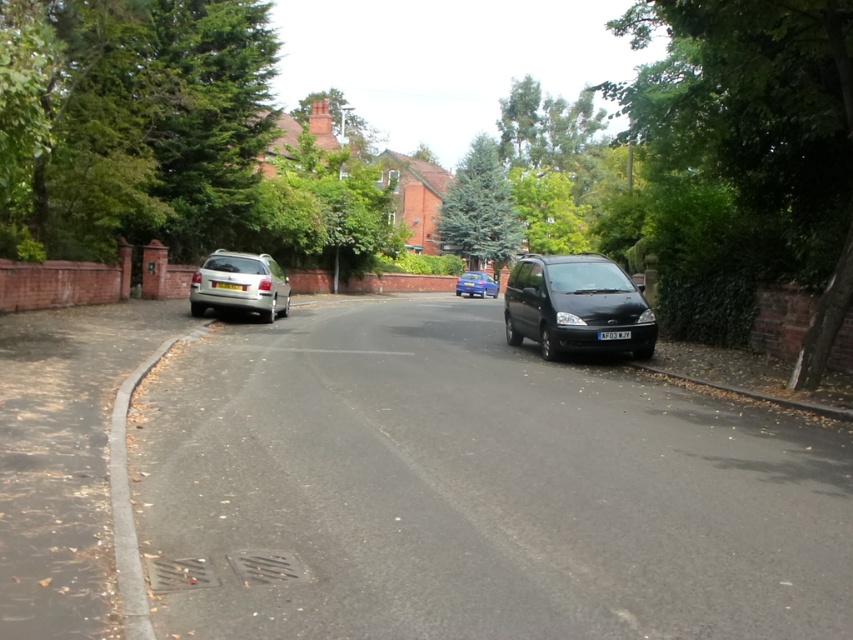
Question: Which object is farther from the camera taking this photo?

Choices:
 (A) blue metallic hatchback at center
 (B) black asphalt driveway at lower left
 (C) yellow plastic license plate at center

Answer: (A)

Question: Does silver metallic hatchback at left have a greater width compared to yellow plastic license plate at center?

Choices:
 (A) no
 (B) yes

Answer: (A)

Question: Among these points, which one is farthest from the camera?

Choices:
 (A) (677, 413)
 (B) (625, 333)
 (C) (288, 300)

Answer: (C)

Question: Does black asphalt driveway at lower left appear on the right side of yellow plastic license plate at center?

Choices:
 (A) yes
 (B) no

Answer: (A)

Question: Which point appears farthest from the camera in this image?

Choices:
 (A) (244, 289)
 (B) (531, 312)
 (C) (502, 484)

Answer: (A)

Question: Is black matte van at center above blue metallic hatchback at center?

Choices:
 (A) no
 (B) yes

Answer: (A)